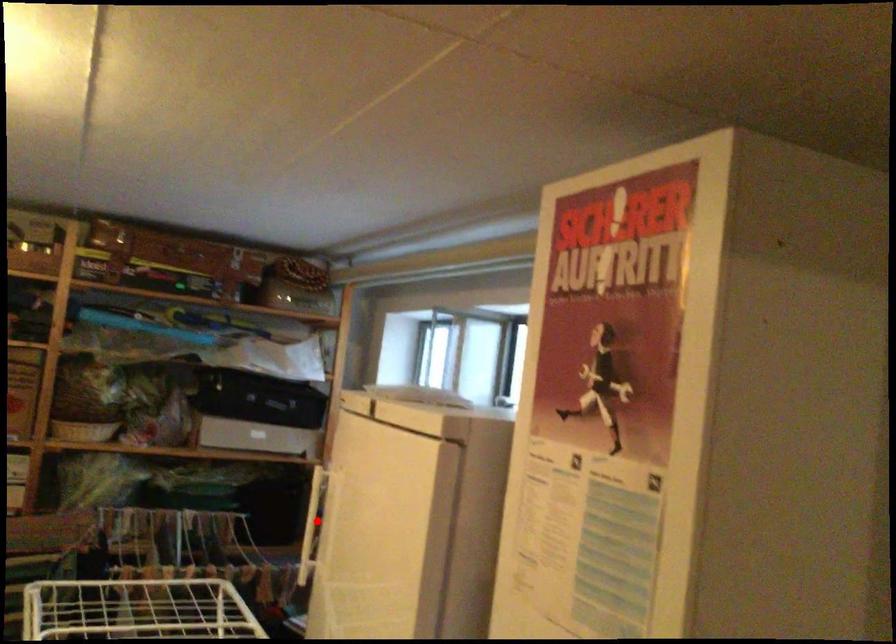
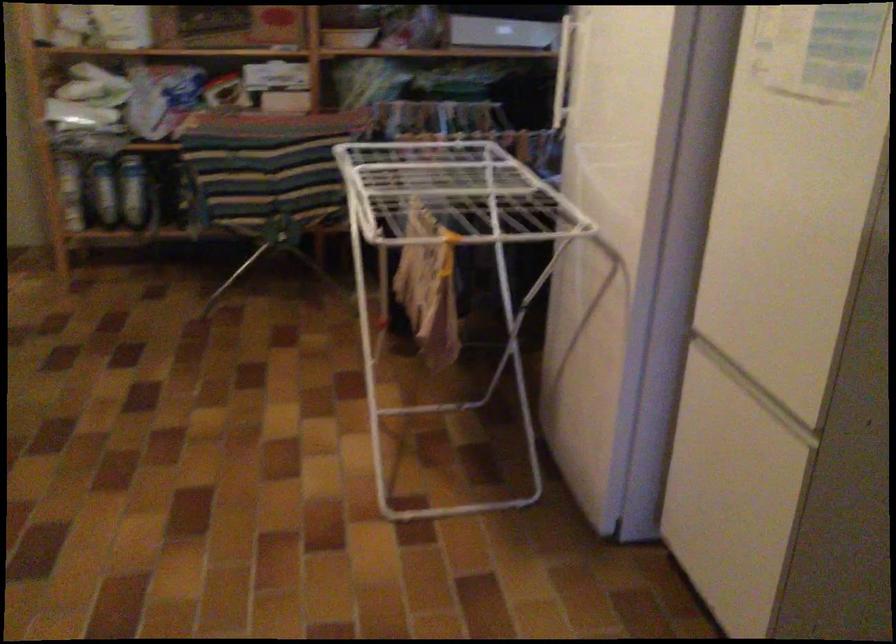
Locate, in the second image, the point that corresponds to the highlighted location in the first image.

(563, 69)